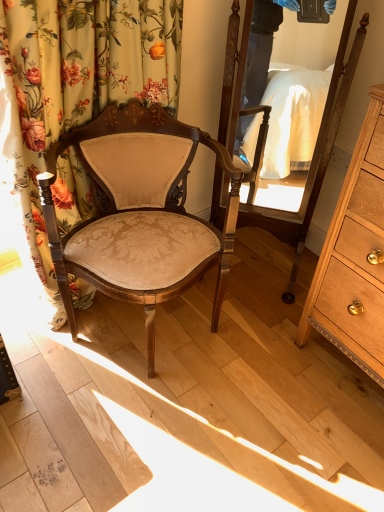
At what (x,y) coordinates should I click in order to perform the action: click on free area below matte beige fabric chair at center (from a real-world perspective). Please return your answer as a coordinate pair (x, y). This screenshot has height=512, width=384. Looking at the image, I should click on (158, 333).